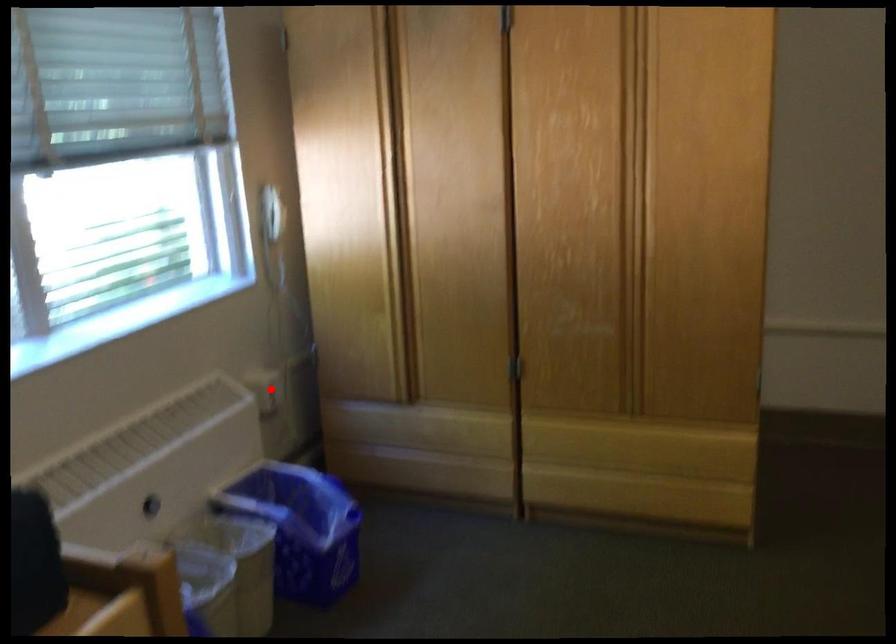
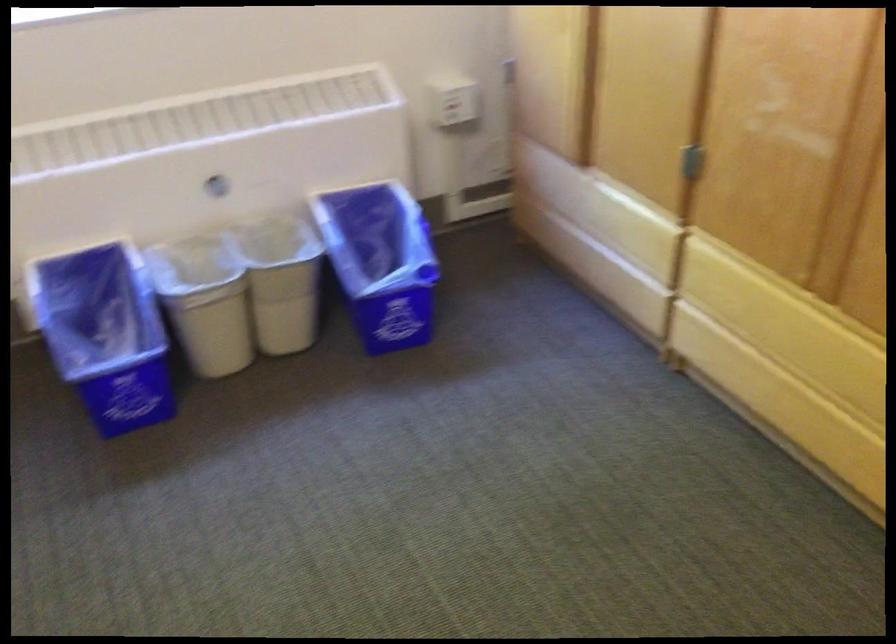
Question: I am providing you with two images of the same scene from different viewpoints. Image1 has a red point marked. In image2, the corresponding 3D location appears at what relative position? Reply with the corresponding letter.

Choices:
 (A) Closer
 (B) Farther

Answer: (A)